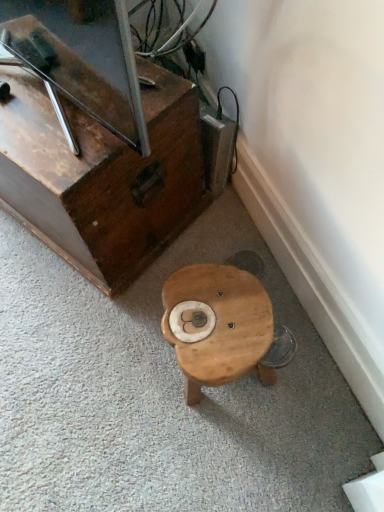
Question: From the image's perspective, is wooden chest at lower left located above or below wooden stool at center?

Choices:
 (A) above
 (B) below

Answer: (A)

Question: Is wooden chest at lower left situated inside wooden stool at center or outside?

Choices:
 (A) inside
 (B) outside

Answer: (B)

Question: From a real-world perspective, is wooden chest at lower left physically located above or below wooden stool at center?

Choices:
 (A) above
 (B) below

Answer: (A)

Question: Is wooden stool at center to the left or to the right of wooden chest at lower left in the image?

Choices:
 (A) left
 (B) right

Answer: (B)

Question: From the image's perspective, is wooden stool at center located above or below wooden chest at lower left?

Choices:
 (A) below
 (B) above

Answer: (A)

Question: Is wooden stool at center wider or thinner than wooden chest at lower left?

Choices:
 (A) thin
 (B) wide

Answer: (A)

Question: Is point 213,272 closer or farther from the camera than point 33,66?

Choices:
 (A) closer
 (B) farther

Answer: (B)